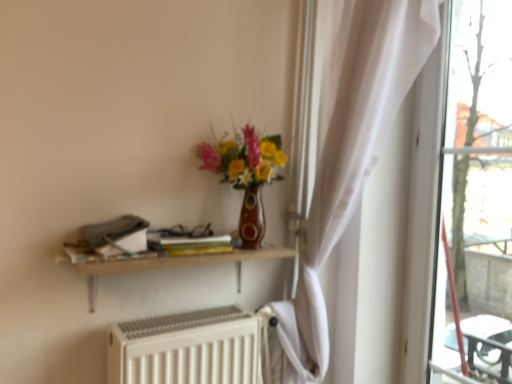
Question: From the image's perspective, is yellow matte book at center below white matte radiator at lower center?

Choices:
 (A) no
 (B) yes

Answer: (A)

Question: Is yellow matte book at center beside white matte radiator at lower center?

Choices:
 (A) no
 (B) yes

Answer: (A)

Question: Is the position of yellow matte book at center more distant than that of white matte radiator at lower center?

Choices:
 (A) no
 (B) yes

Answer: (B)

Question: Is yellow matte book at center smaller than white matte radiator at lower center?

Choices:
 (A) no
 (B) yes

Answer: (B)

Question: From a real-world perspective, is yellow matte book at center physically below white matte radiator at lower center?

Choices:
 (A) yes
 (B) no

Answer: (B)

Question: Considering the relative sizes of yellow matte book at center and white matte radiator at lower center in the image provided, is yellow matte book at center shorter than white matte radiator at lower center?

Choices:
 (A) no
 (B) yes

Answer: (B)

Question: Is white matte radiator at lower center touching matte ceramic vase at center?

Choices:
 (A) yes
 (B) no

Answer: (B)

Question: Is white matte radiator at lower center facing towards matte ceramic vase at center?

Choices:
 (A) yes
 (B) no

Answer: (B)

Question: Can you confirm if white matte radiator at lower center is wider than matte ceramic vase at center?

Choices:
 (A) yes
 (B) no

Answer: (B)

Question: Can we say white matte radiator at lower center lies outside matte ceramic vase at center?

Choices:
 (A) no
 (B) yes

Answer: (B)

Question: Is matte ceramic vase at center at the back of white matte radiator at lower center?

Choices:
 (A) no
 (B) yes

Answer: (A)

Question: Is white matte radiator at lower center further to camera compared to matte ceramic vase at center?

Choices:
 (A) no
 (B) yes

Answer: (A)

Question: From the image's perspective, is wooden shelf at upper center below white matte radiator at lower center?

Choices:
 (A) yes
 (B) no

Answer: (B)